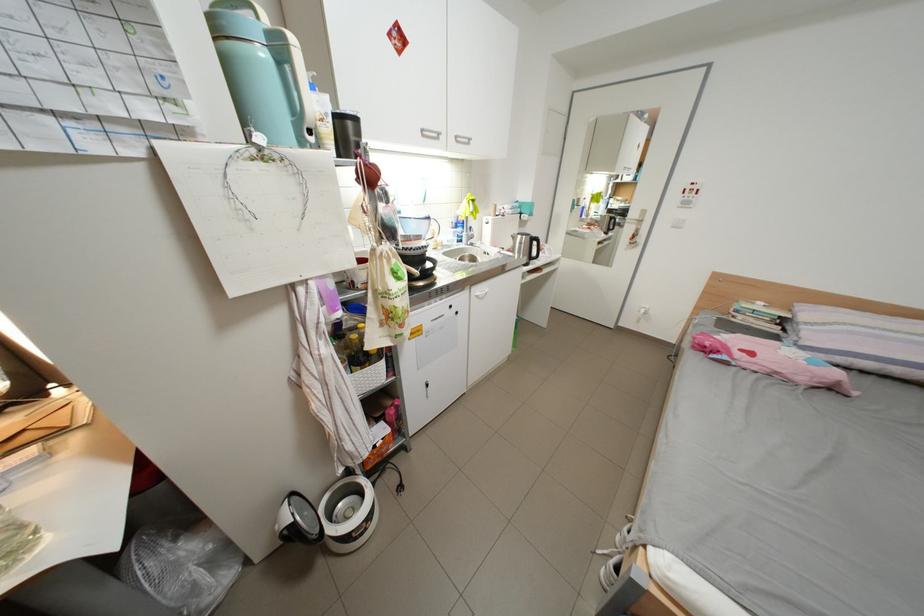
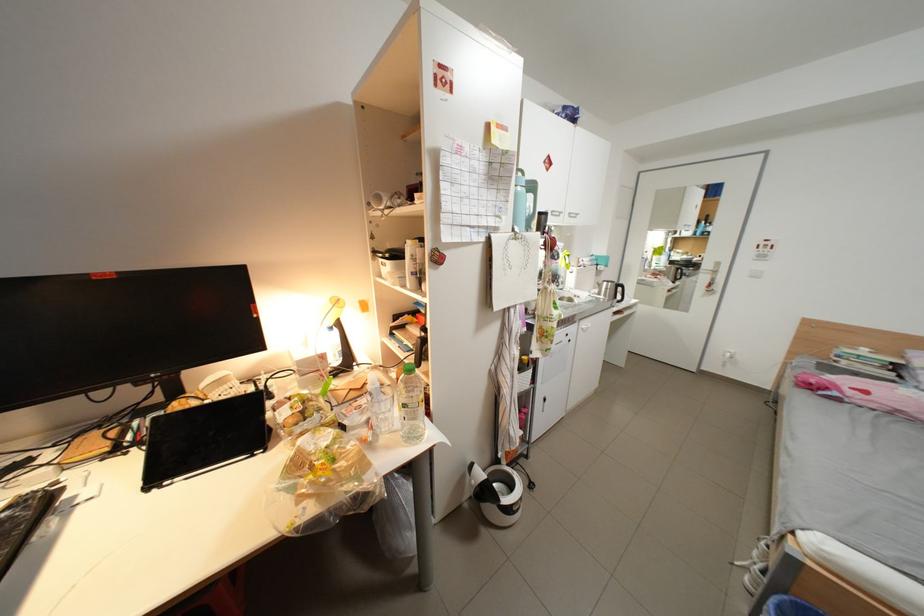
In the second image, find the point that corresponds to [470,300] in the first image.

(582, 331)